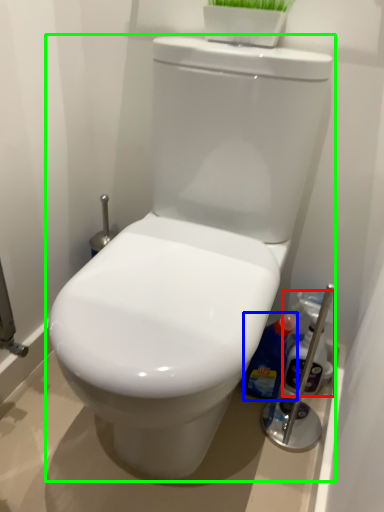
Question: Based on their relative distances, which object is nearer to cleaning product (highlighted by a red box)? Choose from cleaning product (highlighted by a blue box) and toilet (highlighted by a green box).

Choices:
 (A) cleaning product
 (B) toilet

Answer: (A)